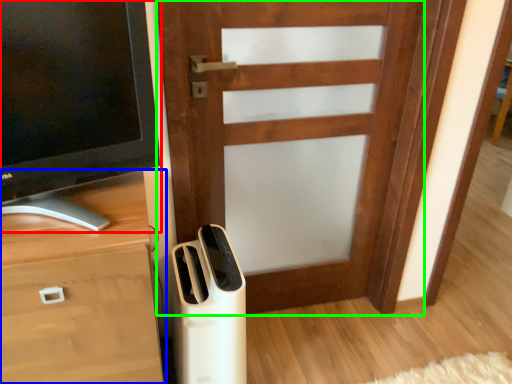
Question: Estimate the real-world distances between objects in this image. Which object is closer to television (highlighted by a red box), chest of drawers (highlighted by a blue box) or door (highlighted by a green box)?

Choices:
 (A) chest of drawers
 (B) door

Answer: (A)